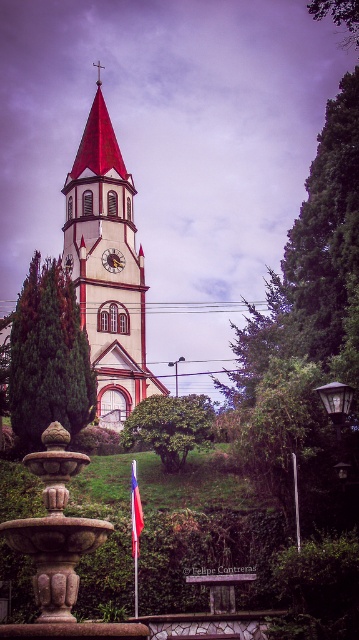
Question: Can you confirm if smooth white steeple at center is thinner than green leafy bush at center?

Choices:
 (A) no
 (B) yes

Answer: (A)

Question: Is green leafy tree at center to the right of gold textured clock at center from the viewer's perspective?

Choices:
 (A) no
 (B) yes

Answer: (A)

Question: Which object is positioned farthest from the green leafy tree at center?

Choices:
 (A) stone fountain at center
 (B) red fabric flag at lower center
 (C) smooth white steeple at center

Answer: (A)

Question: Observing the image, what is the correct spatial positioning of stone fountain at center in reference to gold textured clock at center?

Choices:
 (A) below
 (B) above

Answer: (A)

Question: Which point is farther to the camera?

Choices:
 (A) (126, 280)
 (B) (140, 406)
 (C) (43, 554)

Answer: (A)

Question: Which object appears closest to the camera in this image?

Choices:
 (A) green leafy tree at center
 (B) red fabric flag at lower center

Answer: (B)